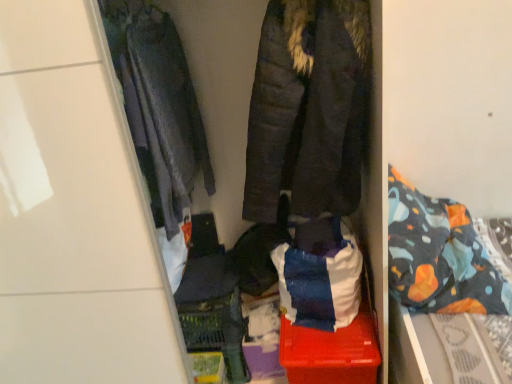
This screenshot has width=512, height=384. Find the location of `free spot above red plastic storage box at center (from a real-world perspective)`. free spot above red plastic storage box at center (from a real-world perspective) is located at coordinates (327, 331).